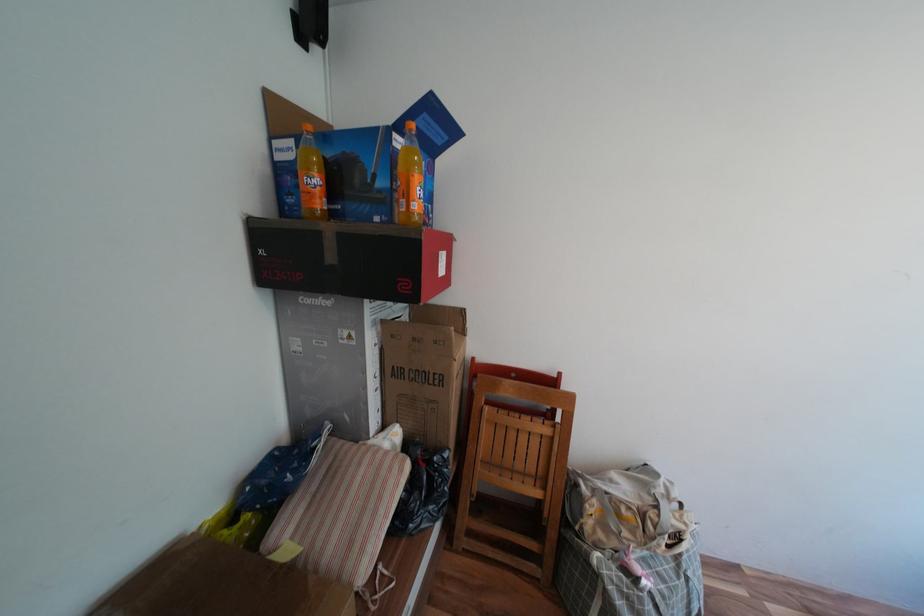
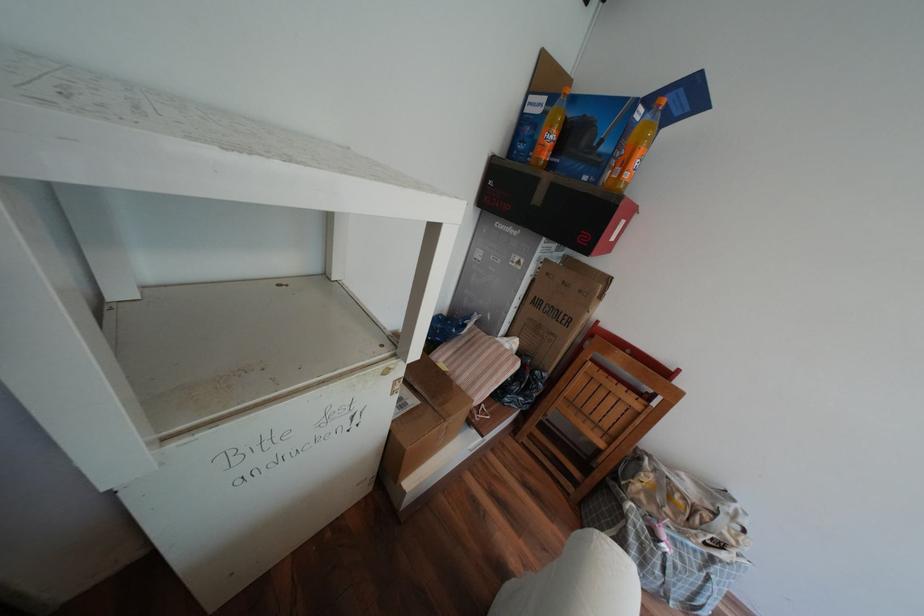
The point at (319, 169) is marked in the first image. Where is the corresponding point in the second image?

(561, 127)